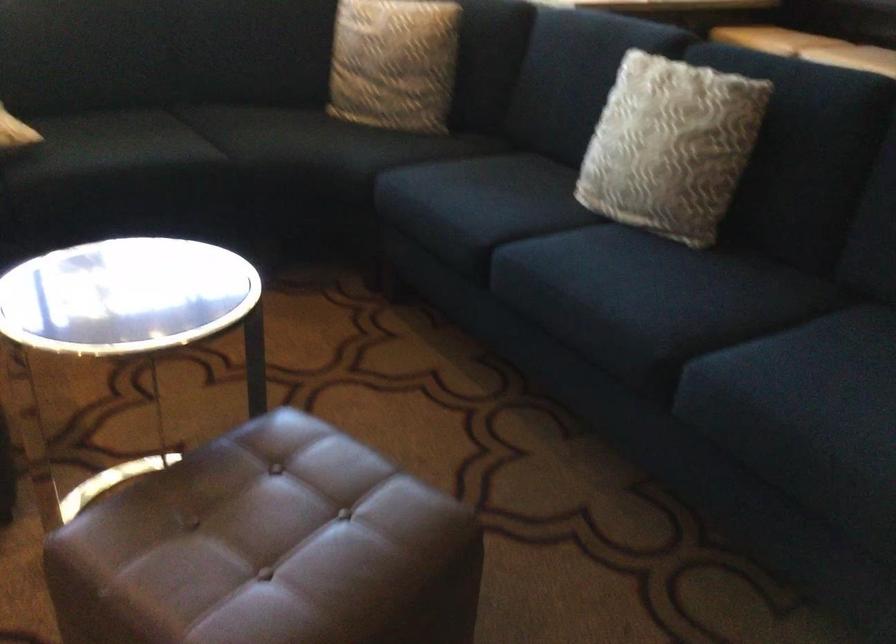
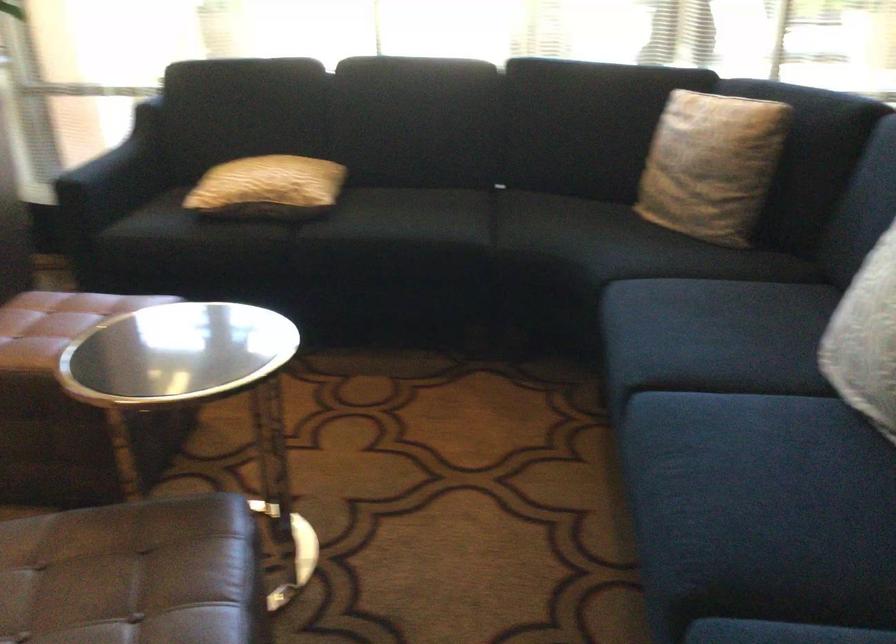
Find the pixel in the second image that matches (304,491) in the first image.

(134, 574)